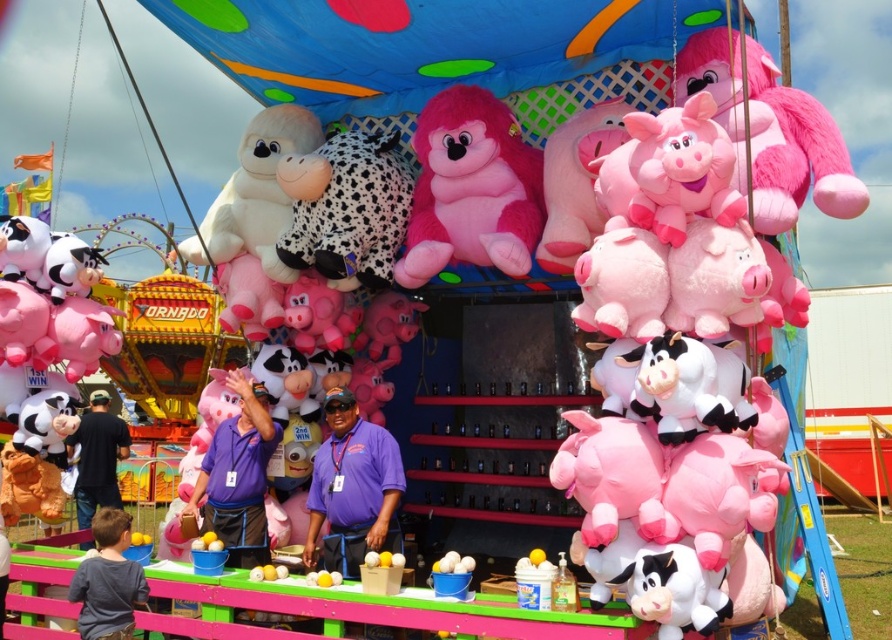
Based on the photo, measure the distance between gray cotton shirt at lower left and camera.

gray cotton shirt at lower left and camera are 4.62 meters apart.

Image resolution: width=892 pixels, height=640 pixels. I want to click on gray cotton shirt at lower left, so click(108, 580).

Is fluffy pink plush monkey at upper right to the right of purple fabric shirt at center from the viewer's perspective?

Yes, fluffy pink plush monkey at upper right is to the right of purple fabric shirt at center.

Can you confirm if fluffy pink plush monkey at upper right is positioned above purple fabric shirt at center?

Indeed, fluffy pink plush monkey at upper right is positioned over purple fabric shirt at center.

Is point (779, 157) positioned behind point (208, 483)?

No, it is not.

I want to click on fluffy pink plush monkey at upper right, so click(770, 131).

Which is more to the left, white plush monkey at upper center or black shirt at lower left?

Positioned to the left is black shirt at lower left.

Does point (257, 156) lie in front of point (88, 436)?

Yes, point (257, 156) is in front of point (88, 436).

The height and width of the screenshot is (640, 892). Find the location of `white plush monkey at upper center`. white plush monkey at upper center is located at coordinates (255, 193).